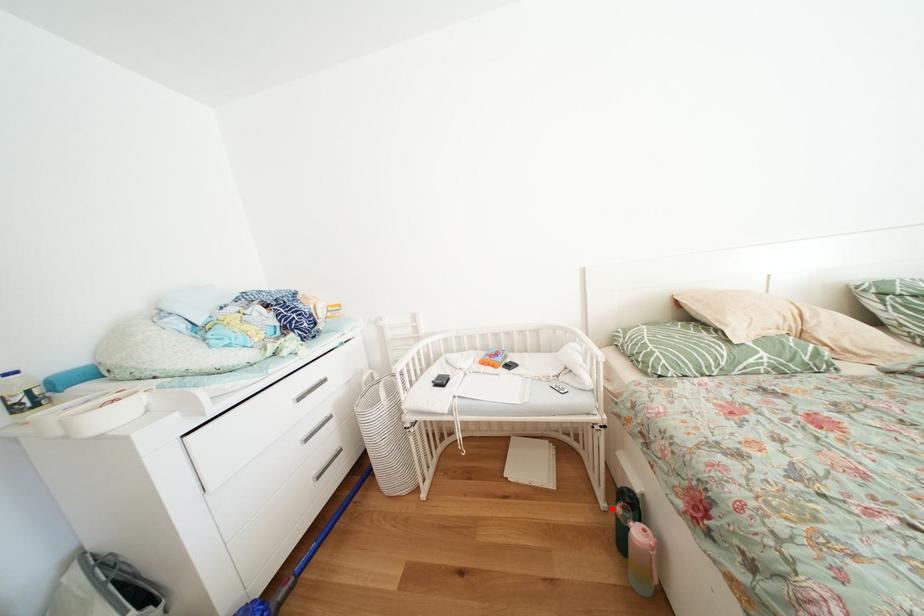
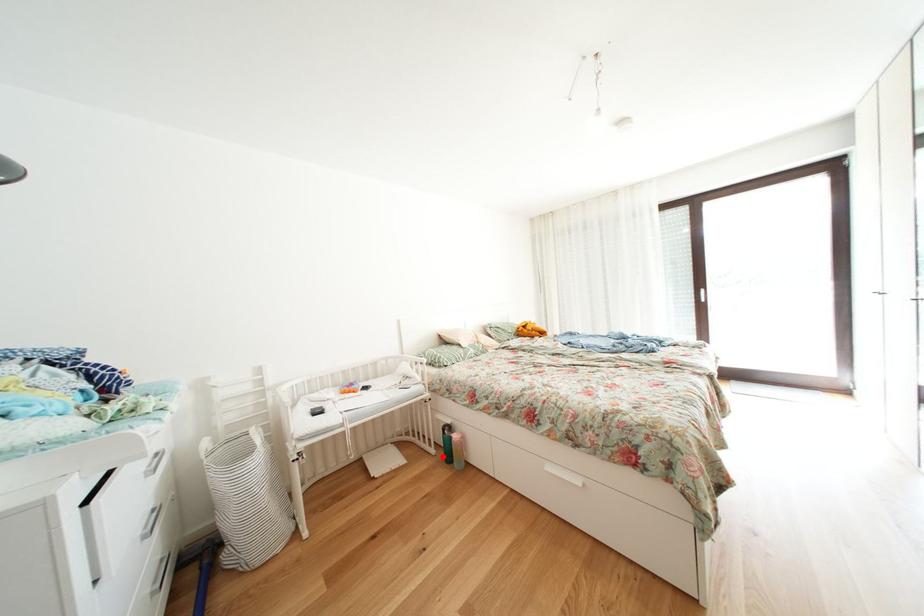
I am providing you with two images of the same scene from different viewpoints. A red point is marked on the first image and another point is marked on the second image. Does the point marked in image1 correspond to the same location as the one in image2?

Yes